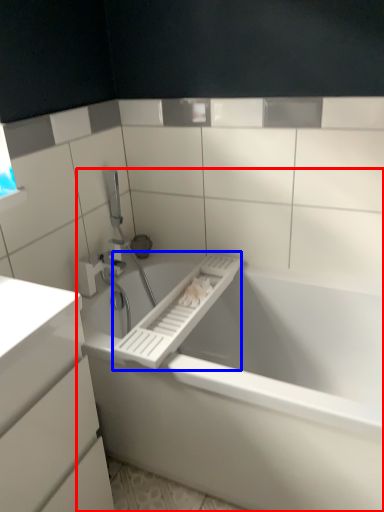
Question: Among these objects, which one is nearest to the camera, bathtub (highlighted by a red box) or towel bar (highlighted by a blue box)?

Choices:
 (A) bathtub
 (B) towel bar

Answer: (A)